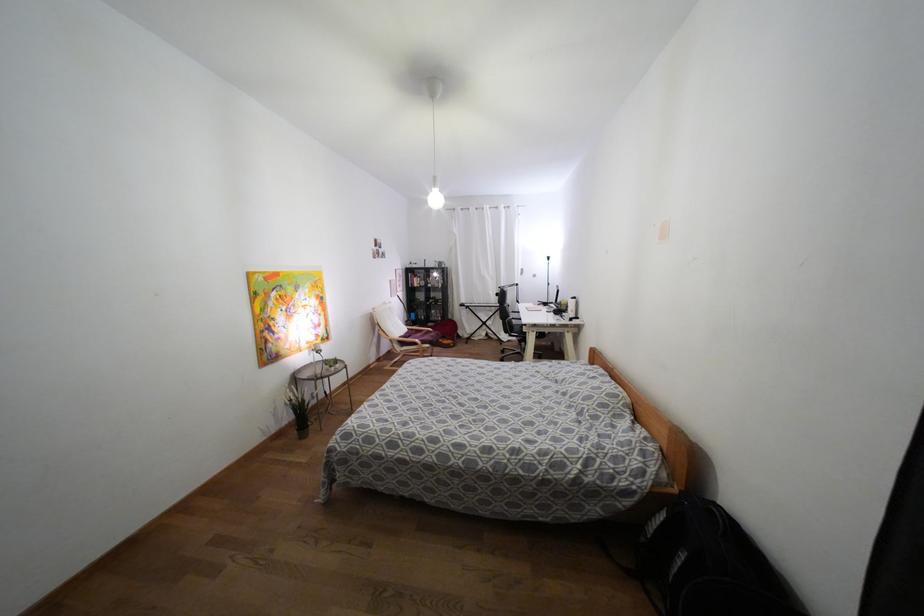
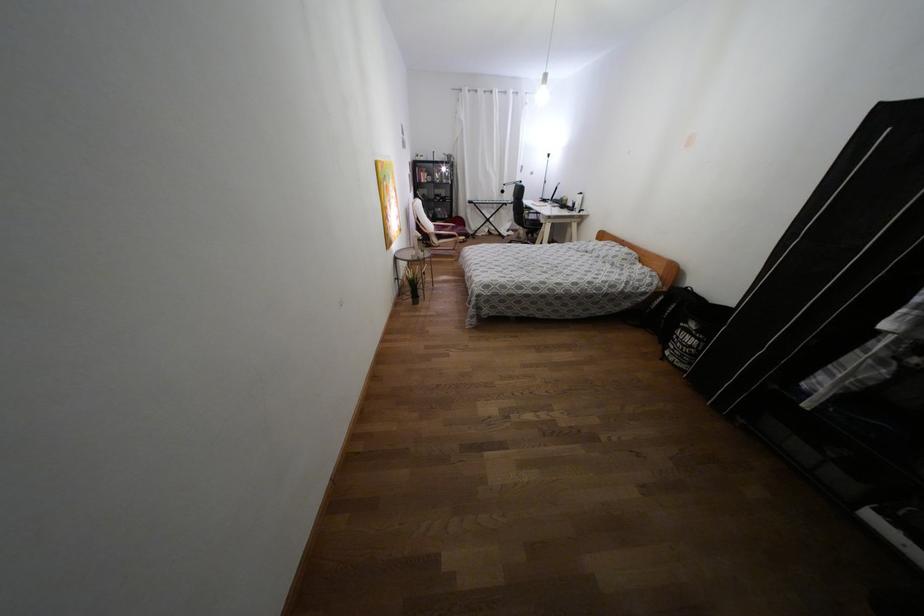
Locate, in the second image, the point that corresponds to [402,342] in the first image.

(439, 237)